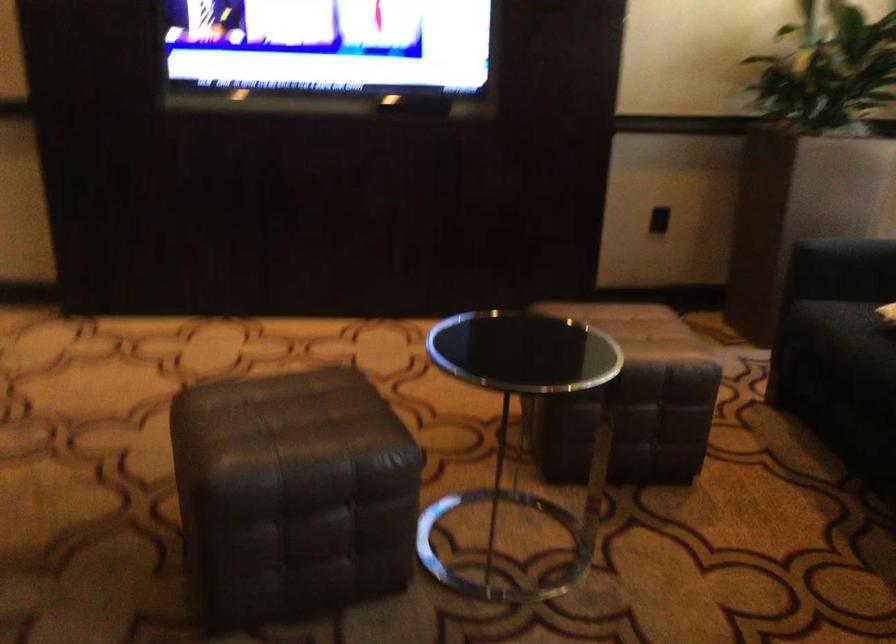
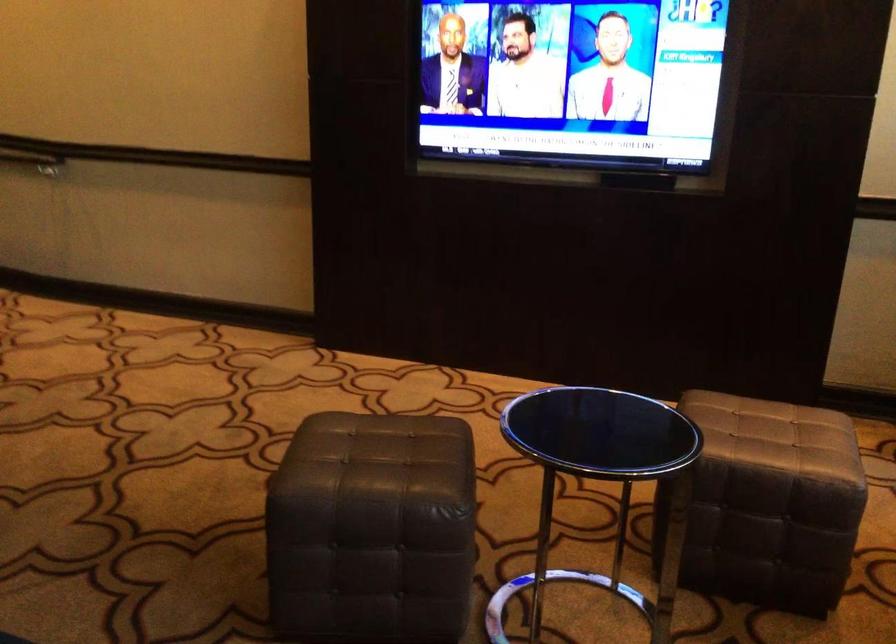
Question: Based on the continuous images, in which direction is the camera rotating? Reply with the corresponding letter.

Choices:
 (A) Left
 (B) Right
 (C) Up
 (D) Down

Answer: (A)